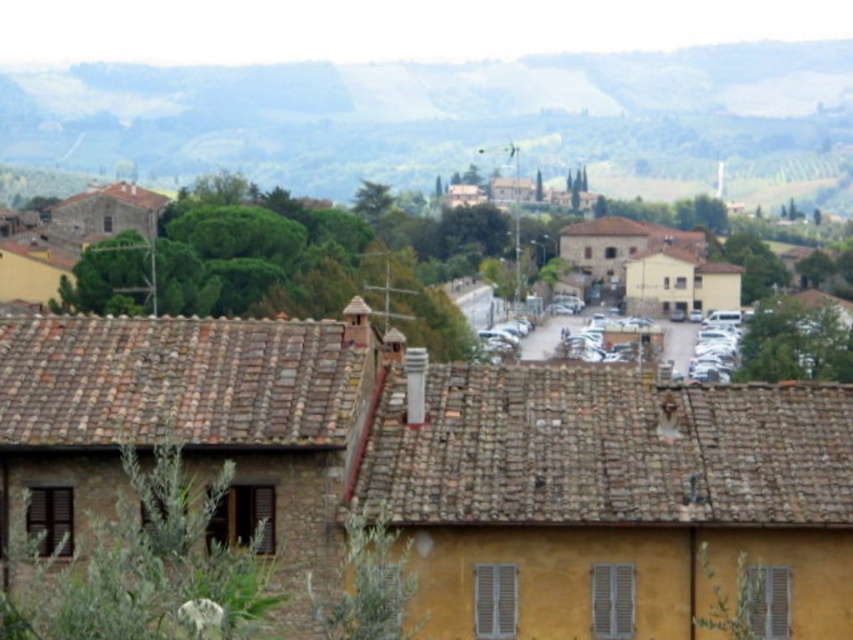
You are standing in front of the brown stone building at center. You want to take a photo of it with your smartphone. Considering the recommended distance for capturing the entire building in one frame is 20 meters, will you need to move closer or farther away?

The brown stone building at center is 20.99 meters away from you. Since the recommended distance is 20 meters, you should move slightly closer to ensure the entire building fits in the photo.

You are a tourist standing at the edge of the town and want to take a photo that includes both the brown stone building at center and the green grassy hillside at upper center. Which object should you position closer to the edge of the frame to ensure both are visible?

Since the brown stone building at center is smaller than the green grassy hillside at upper center, you should position the brown stone building at center closer to the edge of the frame to ensure both are visible.

You are standing at the entrance of the town and see the brown stone building at center and the green grassy hillside at upper center. Which object is positioned to the left of the other?

The brown stone building at center is to the left of green grassy hillside at upper center.